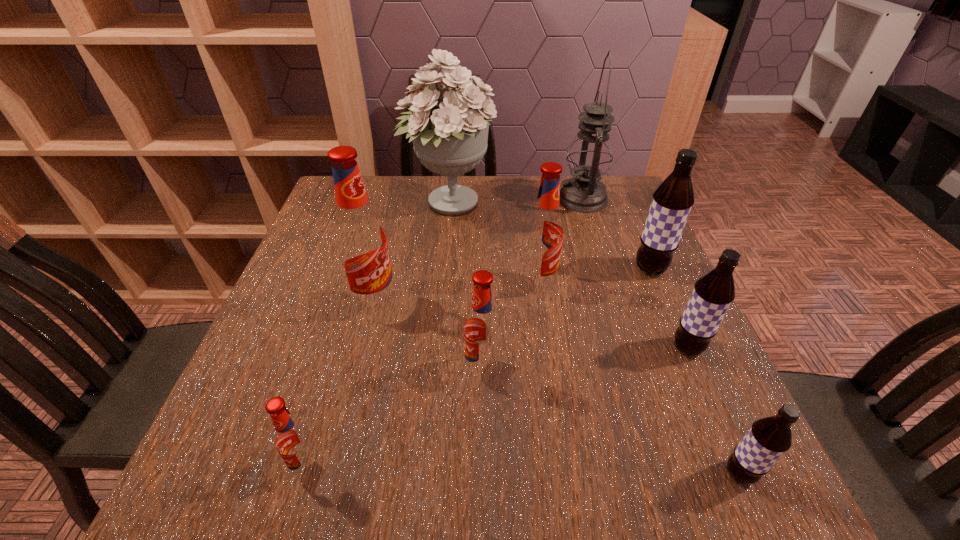
Find the location of a particular element. brown root beer that can be found as the closest to the fifth object from right to left is located at coordinates [672, 201].

The height and width of the screenshot is (540, 960). Find the location of `vacant space that satisfies the following two spatial constraints: 1. on the front side of the bouquet; 2. on the right side of the rightmost red root beer`. vacant space that satisfies the following two spatial constraints: 1. on the front side of the bouquet; 2. on the right side of the rightmost red root beer is located at coordinates (443, 284).

I want to click on free point that satisfies the following two spatial constraints: 1. on the front side of the bouquet; 2. on the left side of the fifth object from right to left, so coord(443,284).